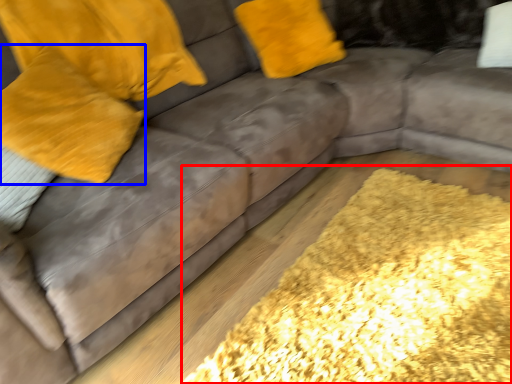
Question: Among these objects, which one is farthest to the camera, mat (highlighted by a red box) or pillow (highlighted by a blue box)?

Choices:
 (A) mat
 (B) pillow

Answer: (B)